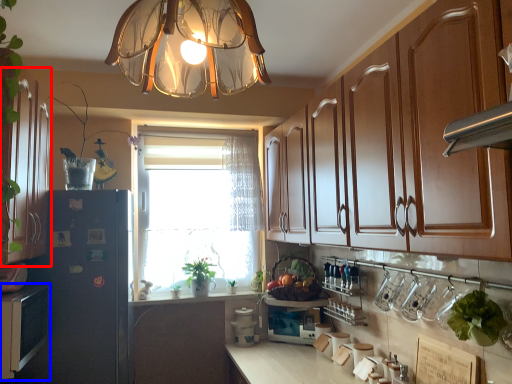
Question: Among these objects, which one is nearest to the camera, cabinetry (highlighted by a red box) or cabinetry (highlighted by a blue box)?

Choices:
 (A) cabinetry
 (B) cabinetry

Answer: (A)